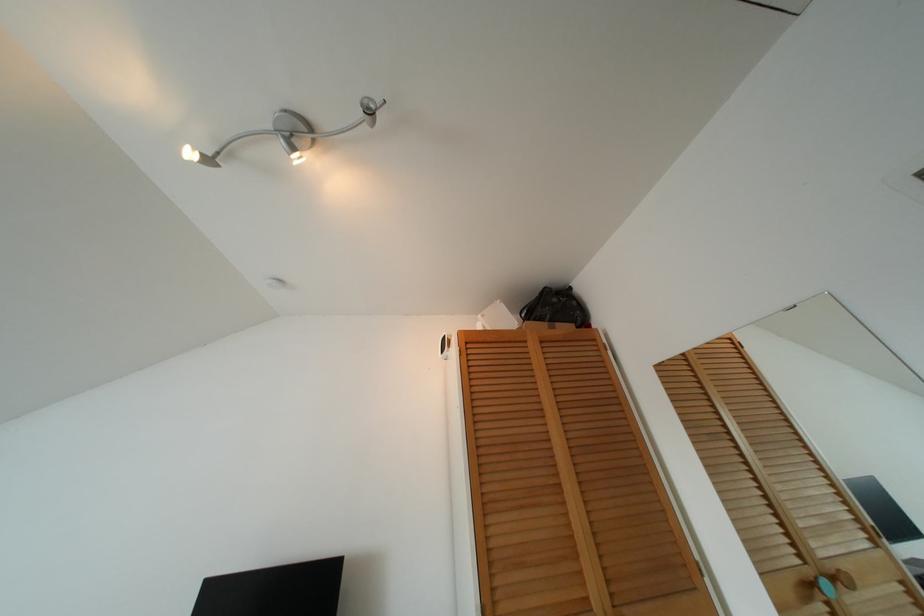
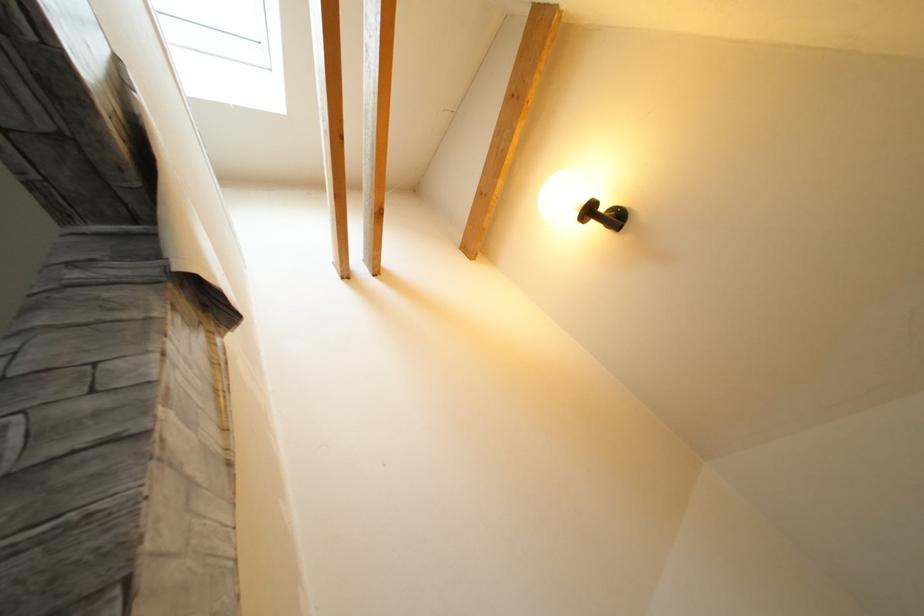
Question: I am providing you with two images of the same scene from different viewpoints. After the viewpoint changes to image2, which objects are now occluded?

Choices:
 (A) peeling wallpaper edge
 (B) white lidded container
 (C) black bag
 (D) spherical light bulb

Answer: (C)